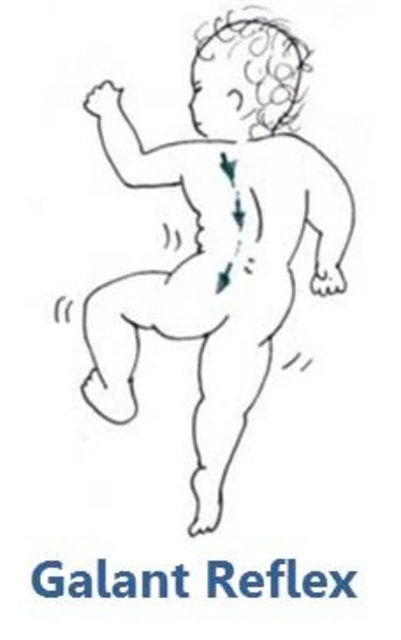
Question: Which point is farther to the camera?

Choices:
 (A) (261, 84)
 (B) (54, 593)

Answer: (A)

Question: Can you confirm if white line drawing of baby at center is thinner than blue text galant reflex at center?

Choices:
 (A) yes
 (B) no

Answer: (A)

Question: In this image, where is white line drawing of baby at center located relative to blue text galant reflex at center?

Choices:
 (A) below
 (B) above

Answer: (B)

Question: Can you confirm if white line drawing of baby at center is wider than blue text galant reflex at center?

Choices:
 (A) yes
 (B) no

Answer: (B)

Question: Which object is farther from the camera taking this photo?

Choices:
 (A) white line drawing of baby at center
 (B) blue text galant reflex at center

Answer: (A)